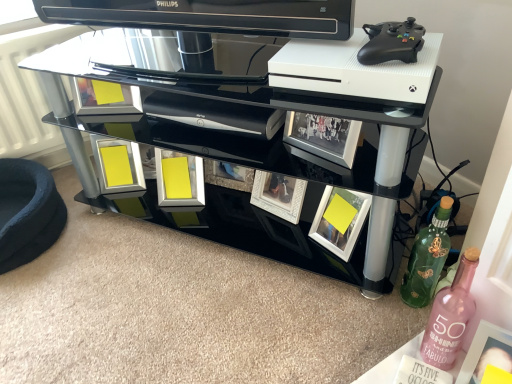
You are a GUI agent. You are given a task and a screenshot of the screen. Output one action in this format:
    pyautogui.click(x=<x>, y=<y>)
    Task: Click on the vacant area that lies between black glass tv stand at center and velvet cushion at lower left
    This screenshot has height=384, width=512.
    Given the screenshot: What is the action you would take?
    pyautogui.click(x=150, y=272)